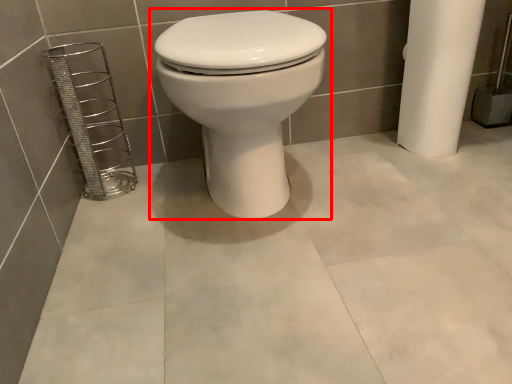
Question: Considering the relative positions of toilet (annotated by the red box) and porcelain in the image provided, where is toilet (annotated by the red box) located with respect to the staircase?

Choices:
 (A) left
 (B) right

Answer: (B)